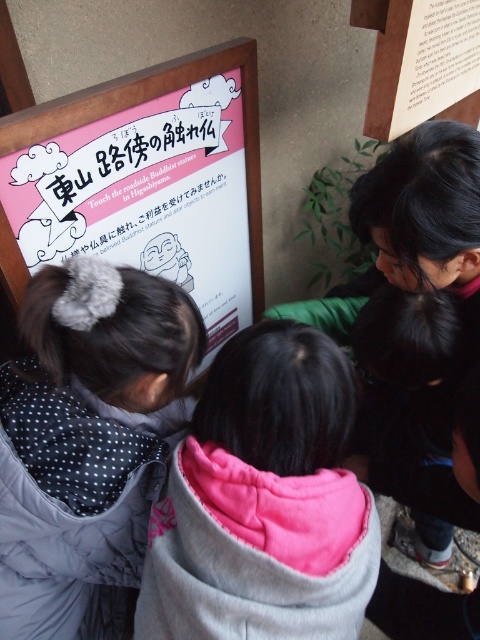
Which is in front, point (20, 422) or point (227, 289)?

Positioned in front is point (20, 422).

Is polka dot scarf at left smaller than pink paper sign at upper left?

Yes.

You are a GUI agent. You are given a task and a screenshot of the screen. Output one action in this format:
    pyautogui.click(x=<x>, y=<y>)
    Task: Click on the polka dot scarf at left
    
    Given the screenshot: What is the action you would take?
    pyautogui.click(x=86, y=440)

The image size is (480, 640). I want to click on polka dot scarf at left, so coord(86,440).

Is point (263, 598) farther from camera compared to point (55, 541)?

That is False.

The height and width of the screenshot is (640, 480). Identify the location of pink fleece jacket at center. (264, 500).

What are the coordinates of `pink fleece jacket at center` in the screenshot? It's located at (264, 500).

Who is lower down, pink fleece jacket at center or pink paper sign at upper left?

pink fleece jacket at center

Can you confirm if pink fleece jacket at center is positioned below pink paper sign at upper left?

Correct, pink fleece jacket at center is located below pink paper sign at upper left.

Who is more distant from viewer, (236,452) or (140,147)?

Point (140,147)

Locate an element on the screen. The height and width of the screenshot is (640, 480). pink fleece jacket at center is located at coordinates (264, 500).